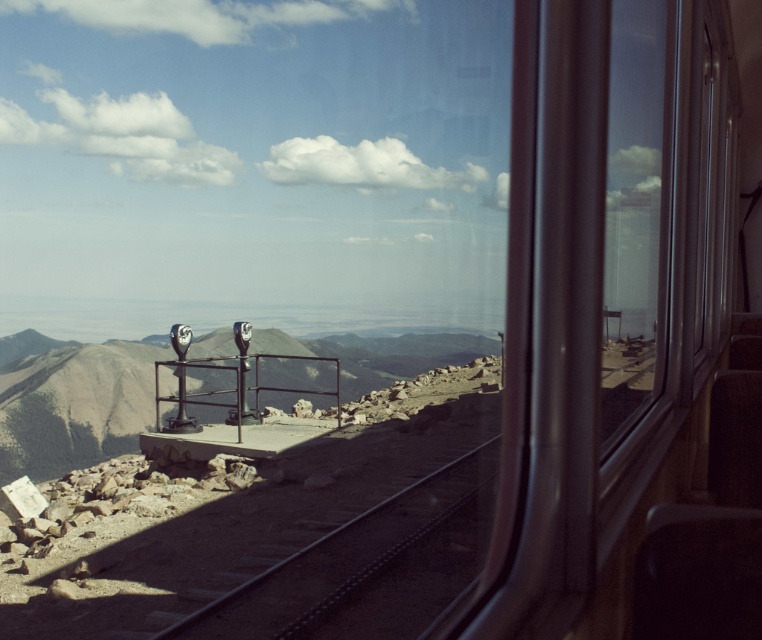
You are a passenger on the train and want to look outside through the transparent glass window at right. To do so, you need to move past the dark brown gravel train track at center. Is the window to your right or left of the track?

The transparent glass window at right is to the right of the dark brown gravel train track at center.

You are a passenger on the train and want to look outside. Which object, the dark brown gravel train track at center or the transparent glass window at right, should you use to see the mountain view?

You should use the transparent glass window at right to see the mountain view because the dark brown gravel train track at center is an obstacle blocking the view.

You are a passenger on the train and want to look outside through the transparent glass window at right. However, the dark brown gravel train track at center is blocking your view. Can you move the train track to get a clear view?

The transparent glass window at right is behind the dark brown gravel train track at center, so you cannot move the train track because it is part of the train infrastructure and cannot be relocated easily.